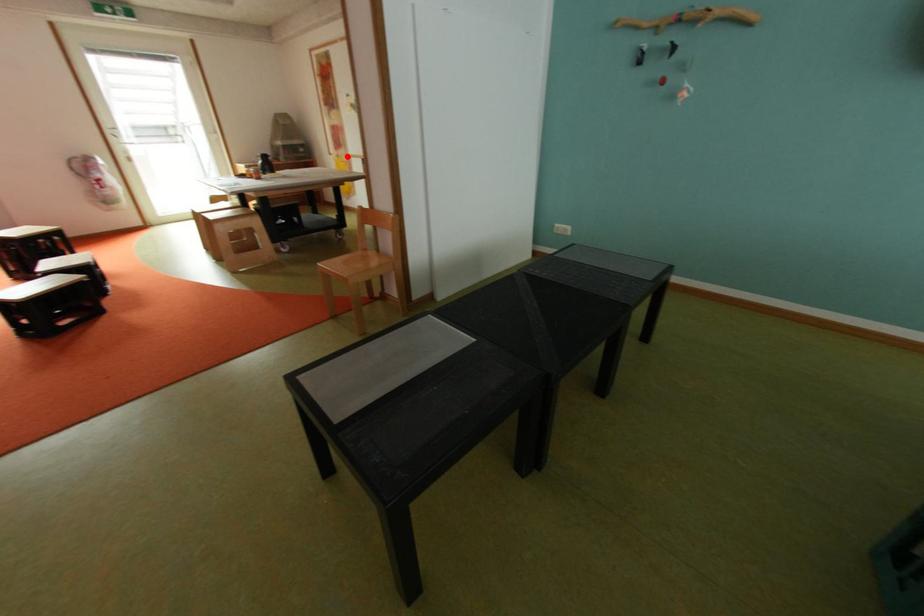
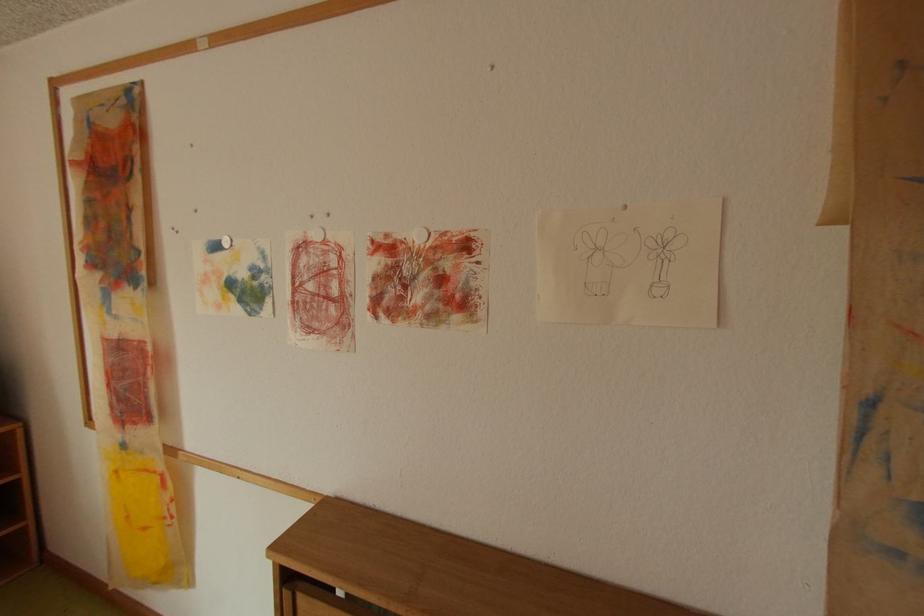
Question: A red point is marked in image1. In image2, is the corresponding 3D point closer to the camera or farther? Reply with the corresponding letter.

Choices:
 (A) The corresponding 3D point is closer.
 (B) The corresponding 3D point is farther.

Answer: (B)